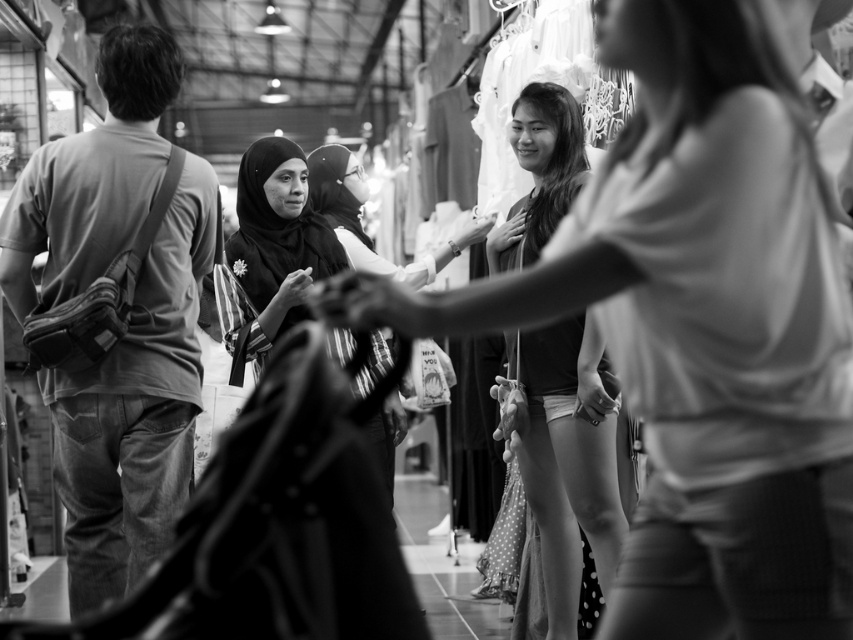
You are a customer in the market and want to examine both the smooth fabric blouse at center and the matte black hijab at center. If you can only reach items within 3 meters, which one can you reach?

The smooth fabric blouse at center is 3.38 meters away from the matte black hijab at center. Since you can only reach items within 3 meters, neither item is within your reach as both are beyond the 3 meter limit.

You are standing in the market scene described. There is a point labeled at coordinates (136, 410). What object is located at that point?

The point at coordinates (136, 410) corresponds to denim jeans at left.

Based on the photo, you are a customer in the market and want to buy both the denim jeans at left and the smooth fabric blouse at center. If you have a bag that can carry items up to the size of the larger one, will your bag be sufficient?

The denim jeans at left is larger in size than the smooth fabric blouse at center. Since your bag can carry items up to the size of the larger one, the denim jeans at left, it should be sufficient to carry both items as long as their combined size does not exceed the bag capacity.